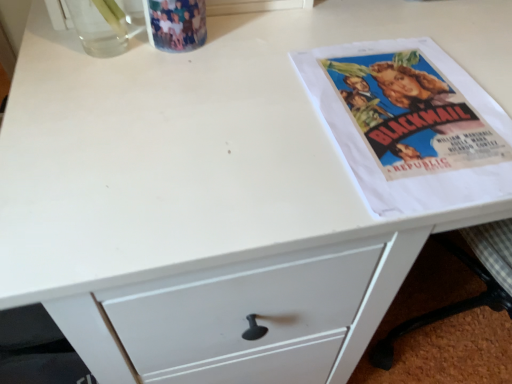
This screenshot has width=512, height=384. What are the coordinates of `free space above white paper at upper right (from a real-world perspective)` in the screenshot? It's located at (411, 98).